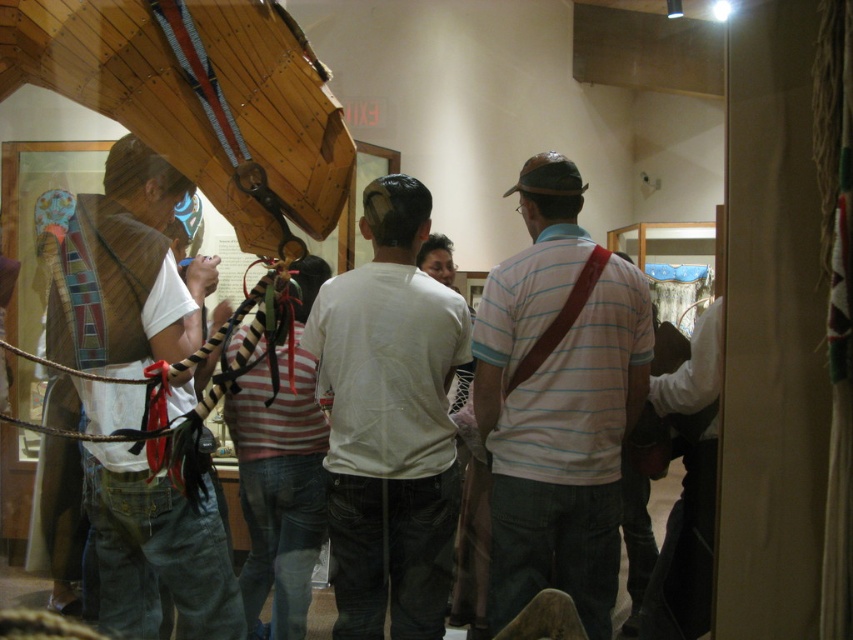
From the picture: Is white striped shirt at center above matte brown vest at left?

No, white striped shirt at center is not above matte brown vest at left.

Locate an element on the screen. white striped shirt at center is located at coordinates (556, 401).

Does white matte shirt at center appear on the right side of matte brown vest at left?

Correct, you'll find white matte shirt at center to the right of matte brown vest at left.

Between point (422, 228) and point (161, 301), which one is positioned in front?

Point (161, 301) is in front.

In order to click on white matte shirt at center in this screenshot , I will do [x=389, y=420].

Who is shorter, white striped shirt at center or white matte shirt at center?

white matte shirt at center

This screenshot has width=853, height=640. Identify the location of white striped shirt at center. (556, 401).

At what (x,y) coordinates should I click in order to perform the action: click on white striped shirt at center. Please return your answer as a coordinate pair (x, y). The image size is (853, 640). Looking at the image, I should click on (556, 401).